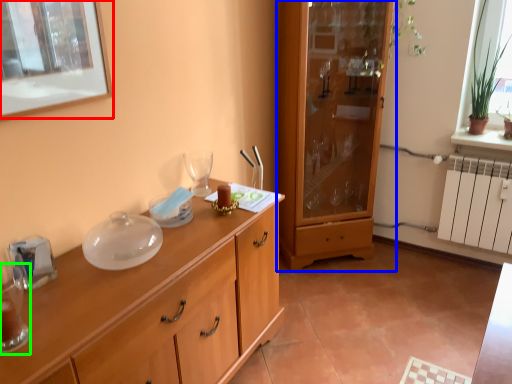
Question: Considering the real-world distances, which object is farthest from picture frame (highlighted by a red box)? cabinetry (highlighted by a blue box) or tableware (highlighted by a green box)?

Choices:
 (A) cabinetry
 (B) tableware

Answer: (A)